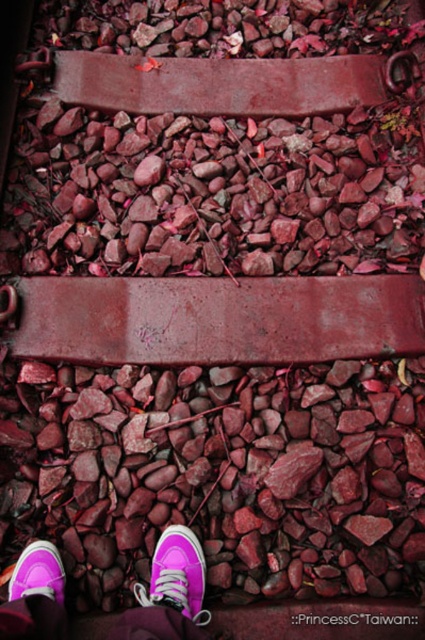
Is point (19, 582) farther from camera compared to point (65, 579)?

No.

Which is above, purple suede sneakers at lower left or purple suede shoe at lower left?

purple suede shoe at lower left

Is point (167, 611) less distant than point (8, 589)?

Yes, point (167, 611) is in front of point (8, 589).

Image resolution: width=425 pixels, height=640 pixels. I want to click on purple suede sneakers at lower left, so click(x=170, y=592).

Is purple suede sneakers at lower left to the left of pink suede sneaker at lower center from the viewer's perspective?

Yes, purple suede sneakers at lower left is to the left of pink suede sneaker at lower center.

Between purple suede sneakers at lower left and pink suede sneaker at lower center, which one has less height?

Standing shorter between the two is purple suede sneakers at lower left.

Where is `purple suede sneakers at lower left`? The height and width of the screenshot is (640, 425). purple suede sneakers at lower left is located at coordinates (170, 592).

The image size is (425, 640). What are the coordinates of `purple suede sneakers at lower left` in the screenshot? It's located at (170, 592).

Which is more to the left, reddish-brown stone gravel at center or purple suede shoe at lower left?

purple suede shoe at lower left is more to the left.

Is reddish-brown stone gravel at center positioned behind purple suede shoe at lower left?

That is True.

Does point (164, 451) lie behind point (51, 557)?

Yes.

This screenshot has height=640, width=425. What are the coordinates of `reddish-brown stone gravel at center` in the screenshot? It's located at (223, 474).